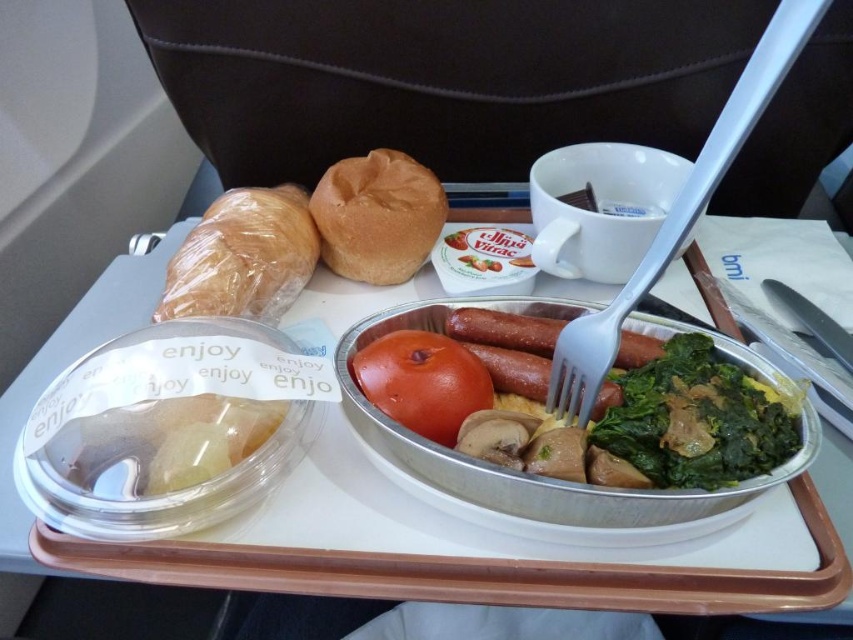
Who is more forward, [392,186] or [451,349]?

Point [451,349]

Does baked golden-brown bread at center have a lesser width compared to red matte tomato at center?

No.

Is point (349, 260) closer to camera compared to point (415, 408)?

No, it is behind (415, 408).

Identify the location of baked golden-brown bread at center. The image size is (853, 640). (376, 216).

In the scene shown: Is green leafy vegetable at center below translucent plastic bread at upper left?

Correct, green leafy vegetable at center is located below translucent plastic bread at upper left.

Which is above, green leafy vegetable at center or translucent plastic bread at upper left?

translucent plastic bread at upper left

Does point (701, 346) come farther from viewer compared to point (305, 282)?

No, (701, 346) is closer to viewer.

Locate an element on the screen. green leafy vegetable at center is located at coordinates (695, 419).

Does green leafy vegetable at center have a larger size compared to red matte tomato at center?

Yes.

In the scene shown: Which is above, green leafy vegetable at center or red matte tomato at center?

Positioned higher is red matte tomato at center.

Who is more forward, [689,481] or [397,381]?

Point [689,481]

Identify the location of green leafy vegetable at center. The width and height of the screenshot is (853, 640). (695, 419).